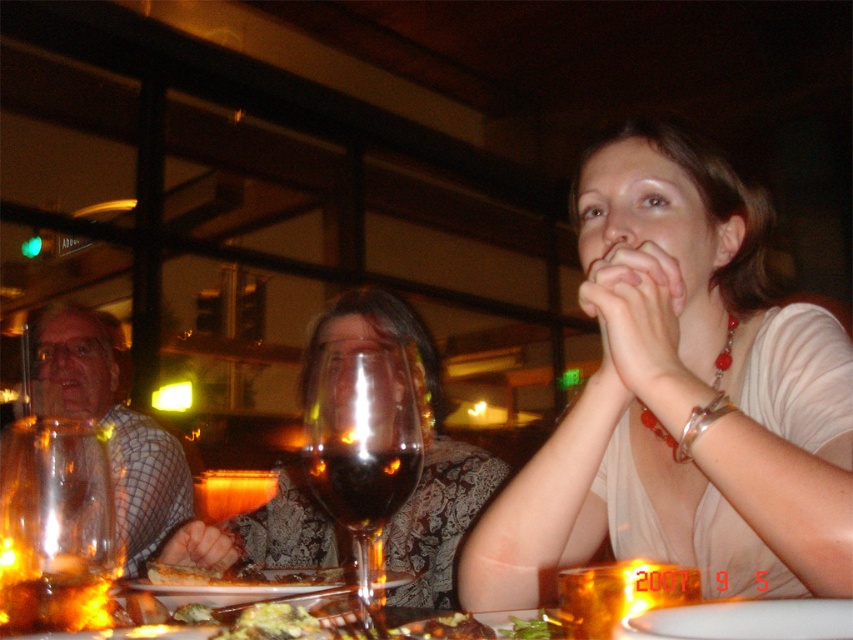
Can you confirm if matte glass wine glass at center is wider than transparent glass wine glass at center?

Correct, the width of matte glass wine glass at center exceeds that of transparent glass wine glass at center.

From the picture: Is the position of matte glass wine glass at center less distant than that of transparent glass wine glass at center?

No, matte glass wine glass at center is further to the viewer.

Is point (254, 515) positioned after point (368, 588)?

Yes, it is behind point (368, 588).

Identify the location of matte glass wine glass at center. The image size is (853, 640). (439, 518).

Is plaid shirt at left positioned at the back of golden brown bread at center?

Yes.

Is plaid shirt at left below golden brown bread at center?

Incorrect, plaid shirt at left is not positioned below golden brown bread at center.

Where is `plaid shirt at left`? The height and width of the screenshot is (640, 853). plaid shirt at left is located at coordinates (112, 424).

How far apart are matte glass wine glass at center and plaid shirt at left?

matte glass wine glass at center and plaid shirt at left are 18.23 inches apart.

Is matte glass wine glass at center closer to camera compared to plaid shirt at left?

Yes.

You are a GUI agent. You are given a task and a screenshot of the screen. Output one action in this format:
    pyautogui.click(x=<x>, y=<y>)
    Task: Click on the matte glass wine glass at center
    The image size is (853, 640).
    Given the screenshot: What is the action you would take?
    pyautogui.click(x=439, y=518)

You are a GUI agent. You are given a task and a screenshot of the screen. Output one action in this format:
    pyautogui.click(x=<x>, y=<y>)
    Task: Click on the matte glass wine glass at center
    Image resolution: width=853 pixels, height=640 pixels.
    Given the screenshot: What is the action you would take?
    pyautogui.click(x=439, y=518)